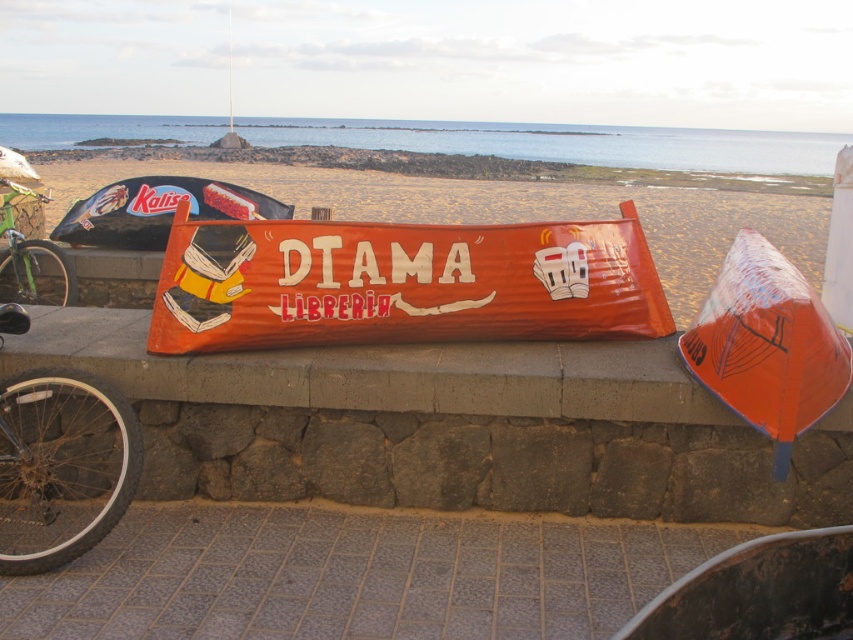
Find the location of a particular element. orange corrugated cardboard sign at center is located at coordinates (402, 284).

Is orange corrugated cardboard sign at center shorter than orange corrugated sign at center?

Yes.

Which is in front, point (283, 336) or point (466, 198)?

Positioned in front is point (283, 336).

I want to click on orange corrugated cardboard sign at center, so click(x=402, y=284).

Does orange corrugated sign at center appear on the left side of silver metallic bicycle wheel at lower left?

No, orange corrugated sign at center is not to the left of silver metallic bicycle wheel at lower left.

Between orange corrugated sign at center and silver metallic bicycle wheel at lower left, which one has less height?

silver metallic bicycle wheel at lower left is shorter.

Measure the distance between orange corrugated sign at center and camera.

5.36 meters

This screenshot has width=853, height=640. In order to click on orange corrugated sign at center in this screenshot , I will do `click(498, 198)`.

Is orange corrugated sign at center smaller than green matte bicycle at left?

Incorrect, orange corrugated sign at center is not smaller in size than green matte bicycle at left.

Does orange corrugated sign at center appear under green matte bicycle at left?

No.

Between point (335, 173) and point (1, 266), which one is positioned behind?

Positioned behind is point (335, 173).

At what (x,y) coordinates should I click in order to perform the action: click on orange corrugated sign at center. Please return your answer as a coordinate pair (x, y). Looking at the image, I should click on (498, 198).